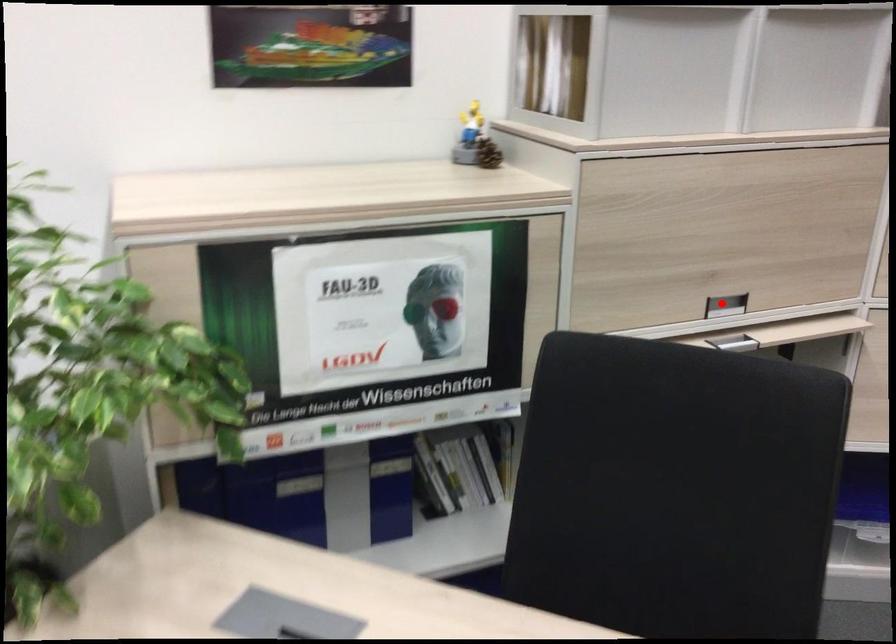
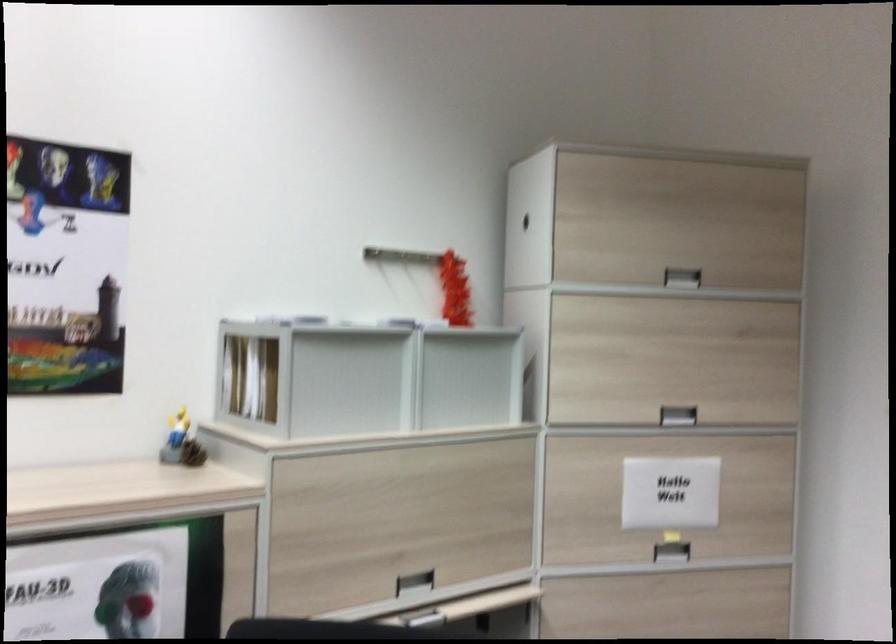
Question: A red point is marked in image1. In image2, is the corresponding 3D point closer to the camera or farther? Reply with the corresponding letter.

Choices:
 (A) The corresponding 3D point is closer.
 (B) The corresponding 3D point is farther.

Answer: (B)